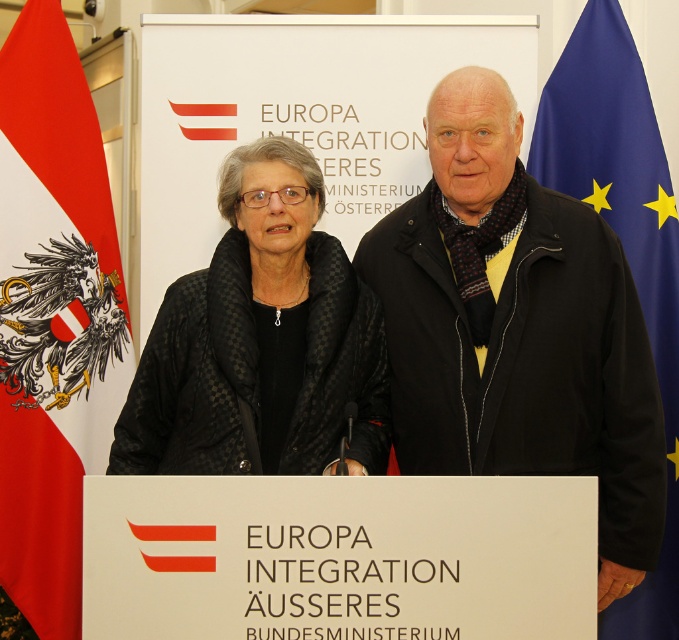
Question: Is black matte jacket at center closer to camera compared to red fabric flag at left?

Choices:
 (A) no
 (B) yes

Answer: (B)

Question: Is the position of black textured coat at center more distant than that of red fabric flag at left?

Choices:
 (A) yes
 (B) no

Answer: (B)

Question: Which is farther from the black matte jacket at center?

Choices:
 (A) black textured coat at center
 (B) red fabric flag at left

Answer: (B)

Question: Does black matte jacket at center have a greater width compared to black textured coat at center?

Choices:
 (A) no
 (B) yes

Answer: (B)

Question: Among these points, which one is nearest to the camera?

Choices:
 (A) (232, 321)
 (B) (627, 564)
 (C) (653, 141)

Answer: (B)

Question: Which object is positioned farthest from the black textured coat at center?

Choices:
 (A) blue fabric flag at center
 (B) red fabric flag at left
 (C) black matte jacket at center

Answer: (A)